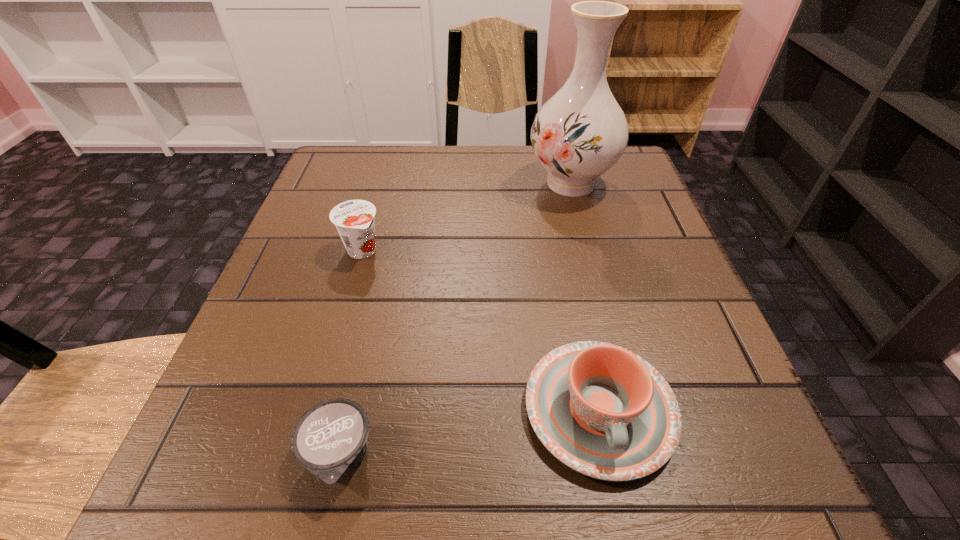
At what (x,y) coordinates should I click in order to perform the action: click on object at the far edge. Please return your answer as a coordinate pair (x, y). The width and height of the screenshot is (960, 540). Looking at the image, I should click on (581, 132).

The height and width of the screenshot is (540, 960). Find the location of `chinaware that is at the near edge`. chinaware that is at the near edge is located at coordinates (603, 411).

Identify the location of yogurt that is at the near edge. This screenshot has height=540, width=960. (330, 439).

At what (x,y) coordinates should I click in order to perform the action: click on vase that is positioned at the right edge. Please return your answer as a coordinate pair (x, y). The image size is (960, 540). Looking at the image, I should click on (581, 132).

Locate an element on the screen. Image resolution: width=960 pixels, height=540 pixels. chinaware present at the right edge is located at coordinates (603, 411).

This screenshot has width=960, height=540. In order to click on object located at the near left corner in this screenshot , I will do `click(330, 439)`.

Locate an element on the screen. The width and height of the screenshot is (960, 540). object that is at the far right corner is located at coordinates (581, 132).

Identify the location of object situated at the near right corner. The width and height of the screenshot is (960, 540). (603, 411).

In order to click on vacant space at the far edge in this screenshot , I will do `click(492, 180)`.

You are a GUI agent. You are given a task and a screenshot of the screen. Output one action in this format:
    pyautogui.click(x=<x>, y=<y>)
    Task: Click on the free location at the left edge of the desktop
    
    Given the screenshot: What is the action you would take?
    pyautogui.click(x=293, y=326)